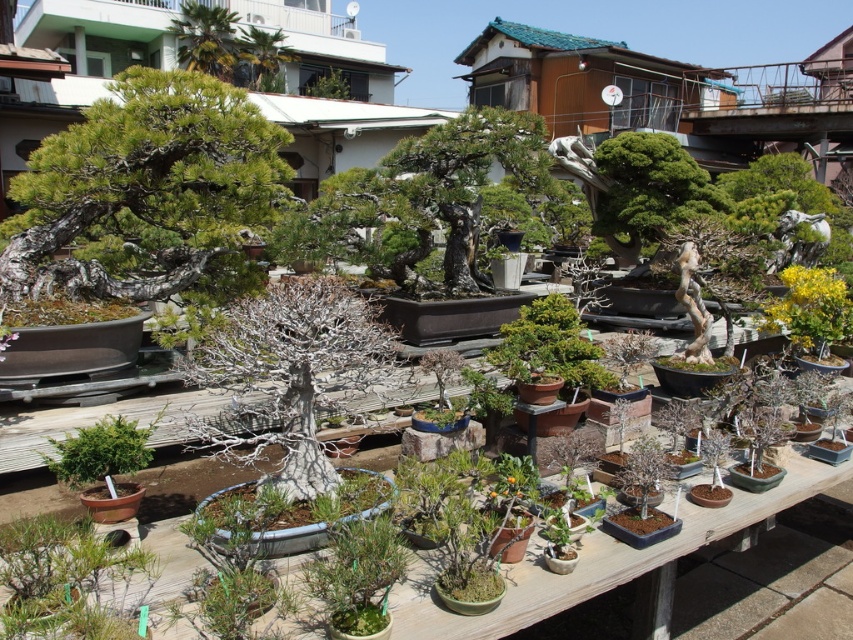
Between bare bark bonsai at center and green glossy bonsai at upper right, which one appears on the right side from the viewer's perspective?

Positioned to the right is green glossy bonsai at upper right.

Is bare bark bonsai at center bigger than green glossy bonsai at upper right?

Indeed, bare bark bonsai at center has a larger size compared to green glossy bonsai at upper right.

The width and height of the screenshot is (853, 640). What do you see at coordinates (289, 376) in the screenshot?
I see `bare bark bonsai at center` at bounding box center [289, 376].

Identify the location of bare bark bonsai at center. This screenshot has height=640, width=853. (289, 376).

Which is behind, point (143, 72) or point (189, 67)?

The point (189, 67) is more distant.

Is point (194, 115) farther from camera compared to point (231, 13)?

No, (194, 115) is in front of (231, 13).

This screenshot has height=640, width=853. What are the coordinates of `green matte bonsai tree at upper left` in the screenshot? It's located at (148, 195).

Who is shorter, bare bark bonsai at center or green leafy palm at upper center?

With less height is bare bark bonsai at center.

Does bare bark bonsai at center appear under green leafy palm at upper center?

Yes.

Between point (379, 352) and point (227, 49), which one is positioned in front?

Point (379, 352) is in front.

I want to click on bare bark bonsai at center, so click(x=289, y=376).